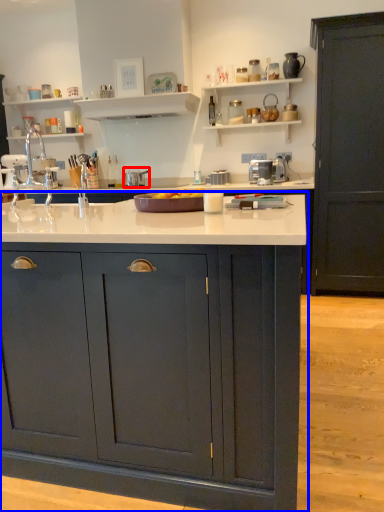
Question: Which point is further to the camera, appliance (highlighted by a red box) or cabinetry (highlighted by a blue box)?

Choices:
 (A) appliance
 (B) cabinetry

Answer: (A)